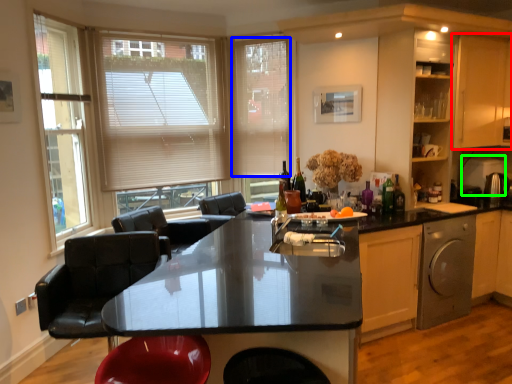
Question: Estimate the real-world distances between objects in this image. Which object is farther from cabinetry (highlighted by a red box), blind (highlighted by a blue box) or appliance (highlighted by a green box)?

Choices:
 (A) blind
 (B) appliance

Answer: (A)